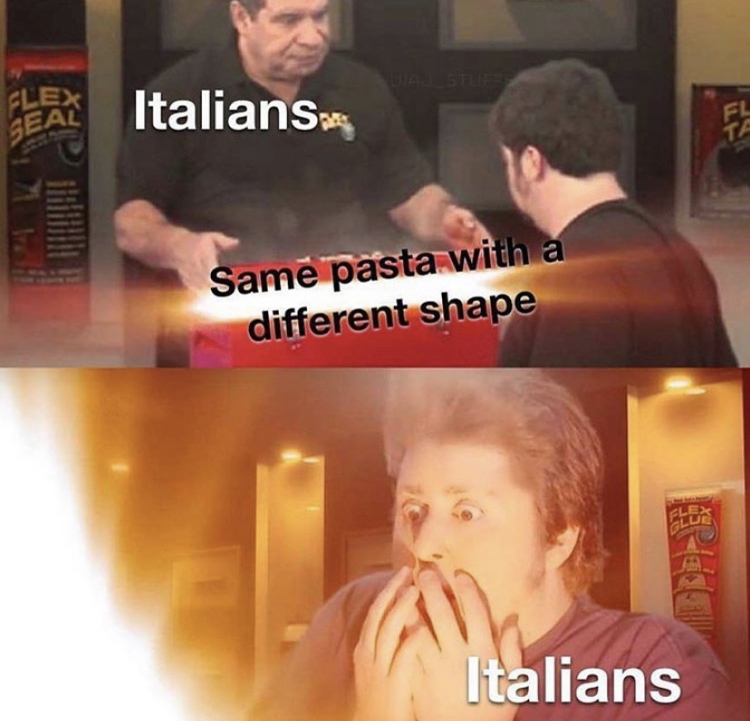
The width and height of the screenshot is (750, 721). Identify the location of lights. (127, 472), (288, 456), (681, 384).